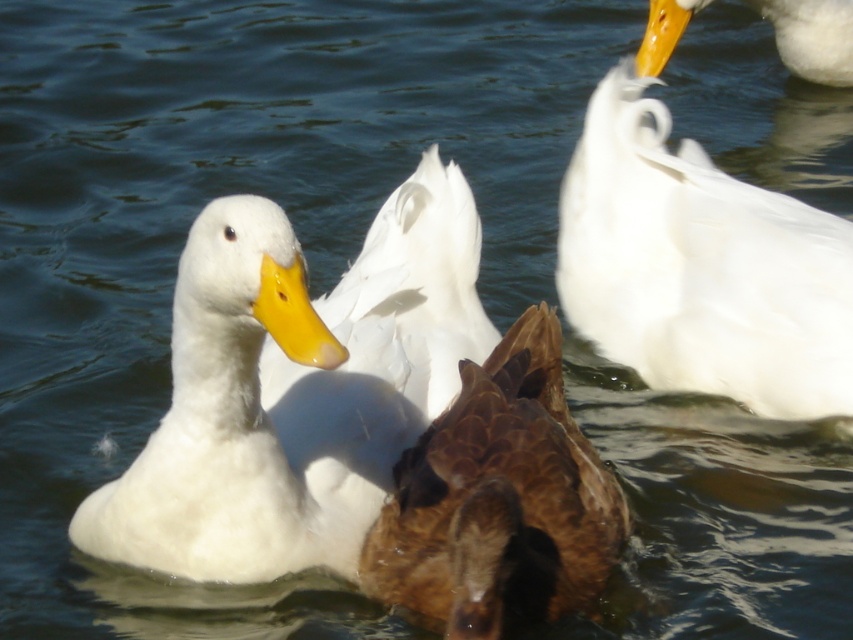
Is point (795, 378) closer to camera compared to point (572, 476)?

No, (795, 378) is further to viewer.

Which is in front, point (672, 323) or point (523, 344)?

Positioned in front is point (523, 344).

Find the location of a particular element. white matte goose at upper right is located at coordinates (700, 266).

Where is `white fluffy duck at center`? The width and height of the screenshot is (853, 640). white fluffy duck at center is located at coordinates (294, 387).

Can you confirm if white fluffy duck at center is positioned to the left of white matte duck at upper right?

Yes, white fluffy duck at center is to the left of white matte duck at upper right.

Find the location of a particular element. white fluffy duck at center is located at coordinates (294, 387).

Locate an element on the screen. white fluffy duck at center is located at coordinates (294, 387).

Is white matte goose at upper right bigger than white matte duck at upper right?

Correct, white matte goose at upper right is larger in size than white matte duck at upper right.

From the picture: Who is more forward, (625, 116) or (793, 72)?

Point (625, 116) is in front.

Which is in front, point (669, 209) or point (838, 8)?

Point (669, 209)

I want to click on white matte goose at upper right, so click(x=700, y=266).